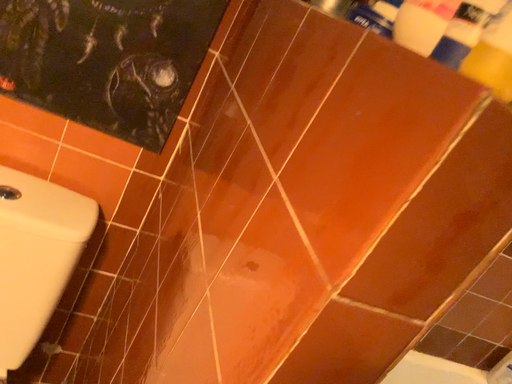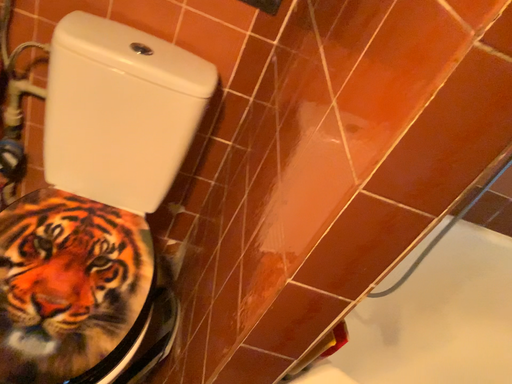
Question: How did the camera likely rotate when shooting the video?

Choices:
 (A) rotated right
 (B) rotated left

Answer: (B)